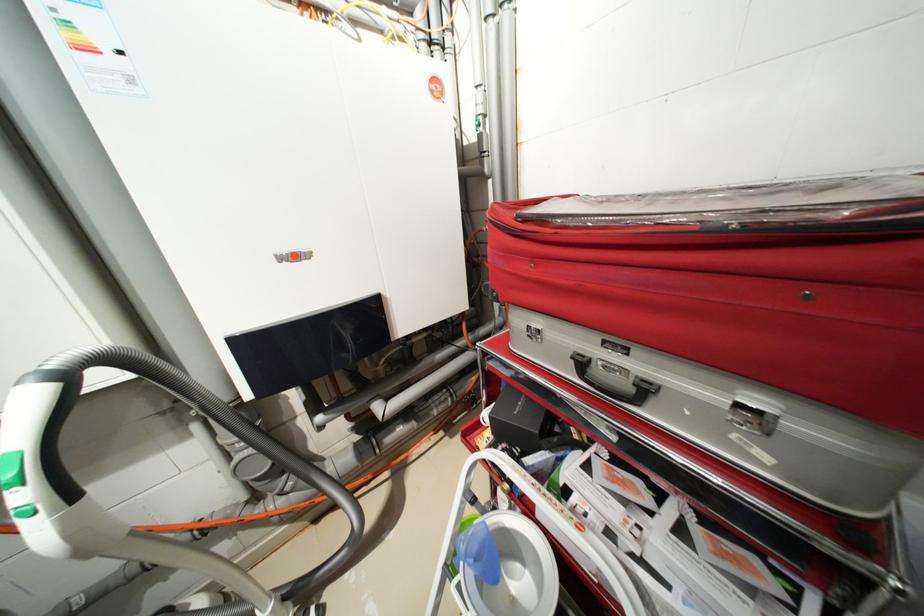
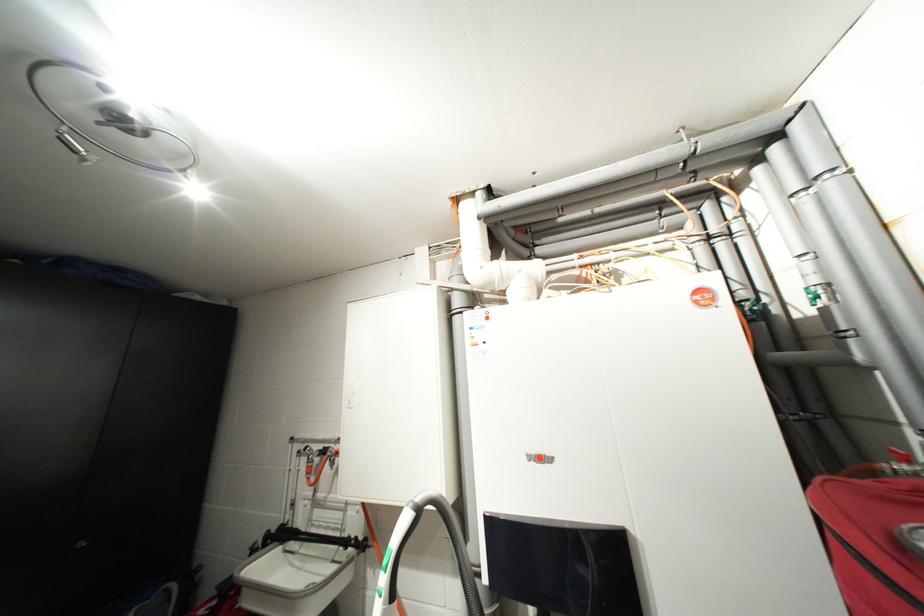
The first image is from the beginning of the video and the second image is from the end. How did the camera likely rotate when shooting the video?

The camera's rotation is toward left-up.